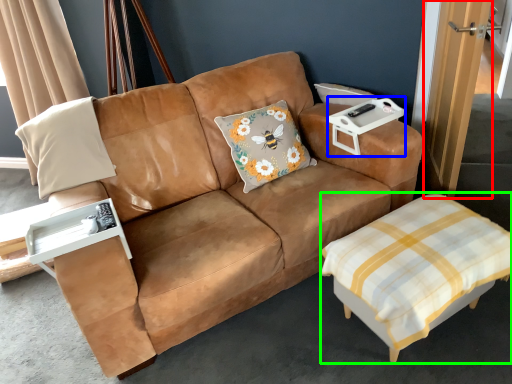
Question: Based on their relative distances, which object is farther from door (highlighted by a red box)? Choose from cocktail table (highlighted by a blue box) and table (highlighted by a green box).

Choices:
 (A) cocktail table
 (B) table

Answer: (B)